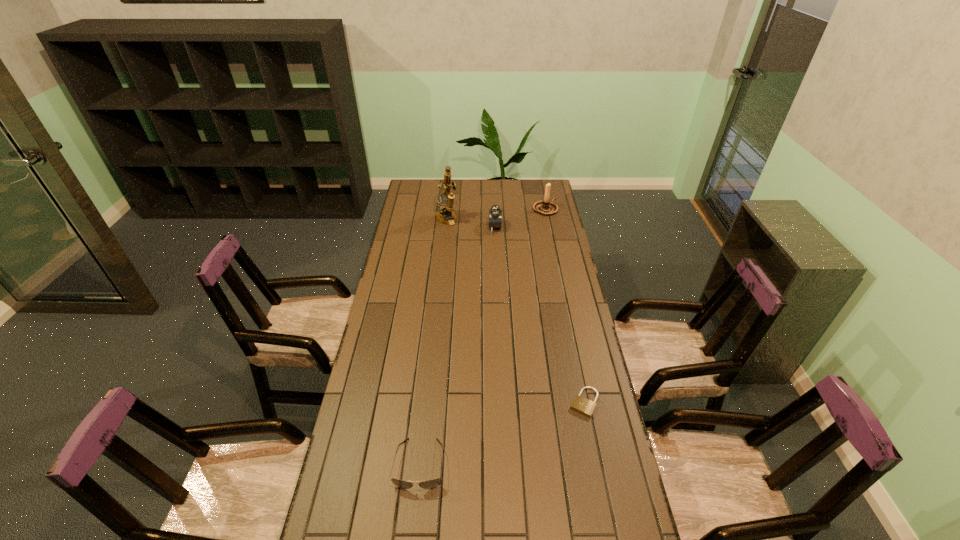
You are a GUI agent. You are given a task and a screenshot of the screen. Output one action in this format:
    pyautogui.click(x=<x>, y=<y>)
    Task: Click on the vacant space situated 0.370m on the front side of the third object from left to right
    
    Given the screenshot: What is the action you would take?
    pyautogui.click(x=414, y=227)

Image resolution: width=960 pixels, height=540 pixels. Find the location of `vacant point located on the front side of the third object from left to right`. vacant point located on the front side of the third object from left to right is located at coordinates pyautogui.click(x=470, y=227).

This screenshot has height=540, width=960. Find the location of `vacant space located 0.380m on the front side of the third object from left to right`. vacant space located 0.380m on the front side of the third object from left to right is located at coordinates (411, 227).

Identify the location of vacant position located 0.100m on the front-facing side of the nearest object. (413, 531).

This screenshot has height=540, width=960. I want to click on free space located on the left of the padlock, so click(507, 402).

At what (x,y) coordinates should I click in order to perform the action: click on object present at the left edge. Please return your answer as a coordinate pair (x, y). Looking at the image, I should click on (433, 483).

Image resolution: width=960 pixels, height=540 pixels. In order to click on candle holder situated at the right edge in this screenshot , I will do `click(545, 207)`.

This screenshot has height=540, width=960. What are the coordinates of `padlock positioned at the right edge` in the screenshot? It's located at (584, 406).

This screenshot has width=960, height=540. In the image, there is a desktop. Find the location of `vacant space at the far edge`. vacant space at the far edge is located at coordinates (475, 185).

I want to click on vacant region at the left edge of the desktop, so click(x=417, y=252).